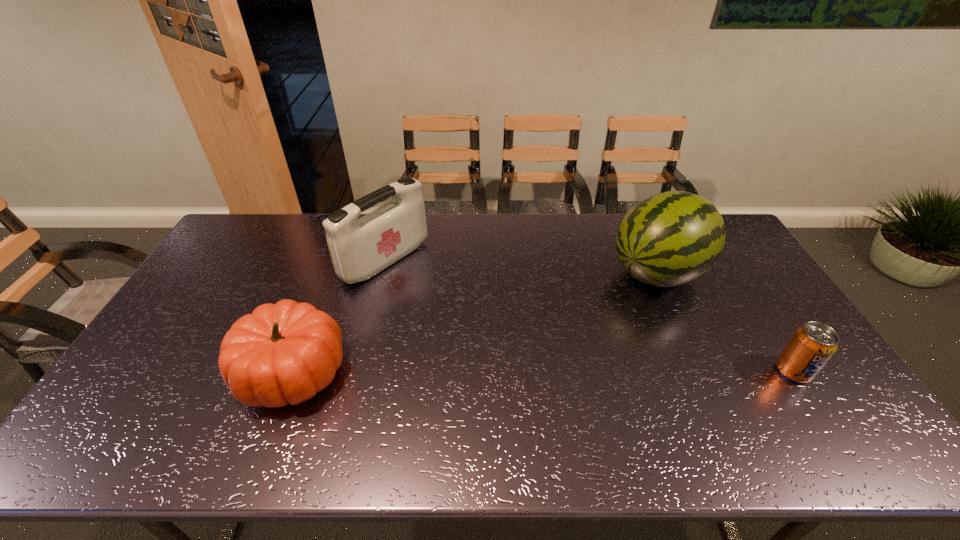
Locate an element on the screen. Image resolution: width=960 pixels, height=540 pixels. vacant space on the desktop that is between the second shortest object and the shortest object and is positioned on the front side of the first-aid kit is located at coordinates (555, 371).

You are a GUI agent. You are given a task and a screenshot of the screen. Output one action in this format:
    pyautogui.click(x=<x>, y=<y>)
    Task: Click on the free space on the desktop that is between the pumpkin and the soda can and is positioned at the stem end of the third object from left to right
    This screenshot has width=960, height=540.
    Given the screenshot: What is the action you would take?
    pyautogui.click(x=495, y=372)